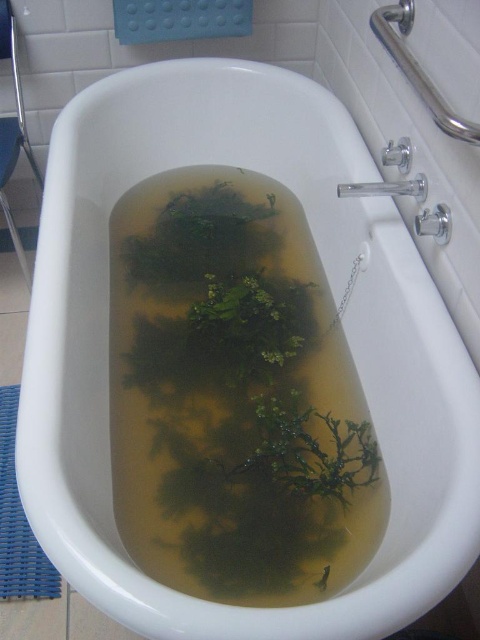
Where is the green murky water at center located in the image?

The green murky water at center is located at point (235, 396) in the image.